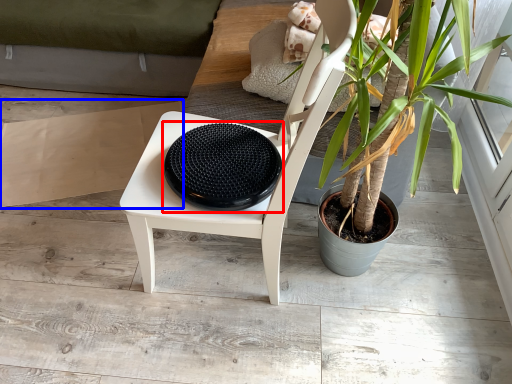
Question: Which of the following is the closest to the observer, manhole cover (highlighted by a red box) or cardboard (highlighted by a blue box)?

Choices:
 (A) manhole cover
 (B) cardboard

Answer: (A)